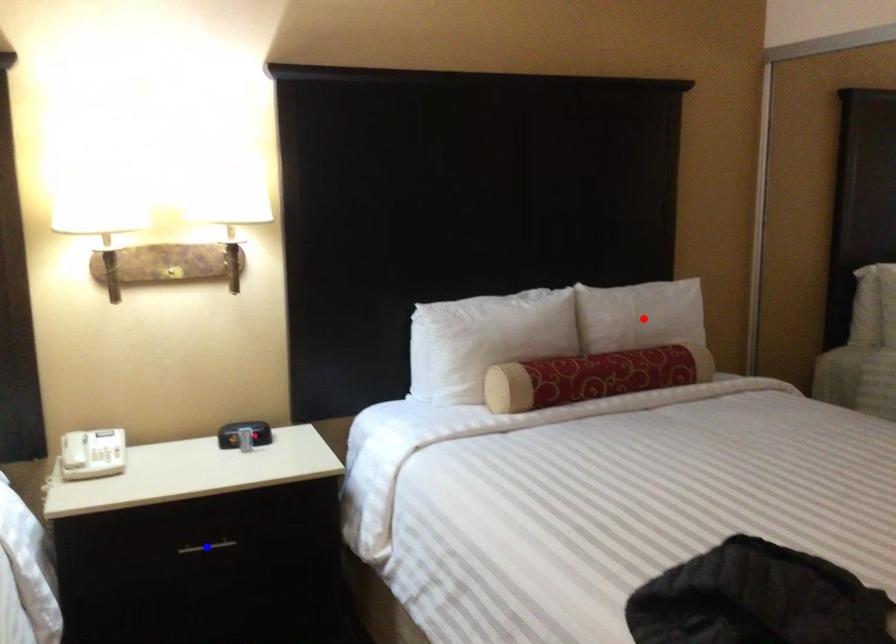
Question: Two points are marked on the image. Which point is closer to the camera?

Choices:
 (A) Blue point is closer.
 (B) Red point is closer.

Answer: (A)